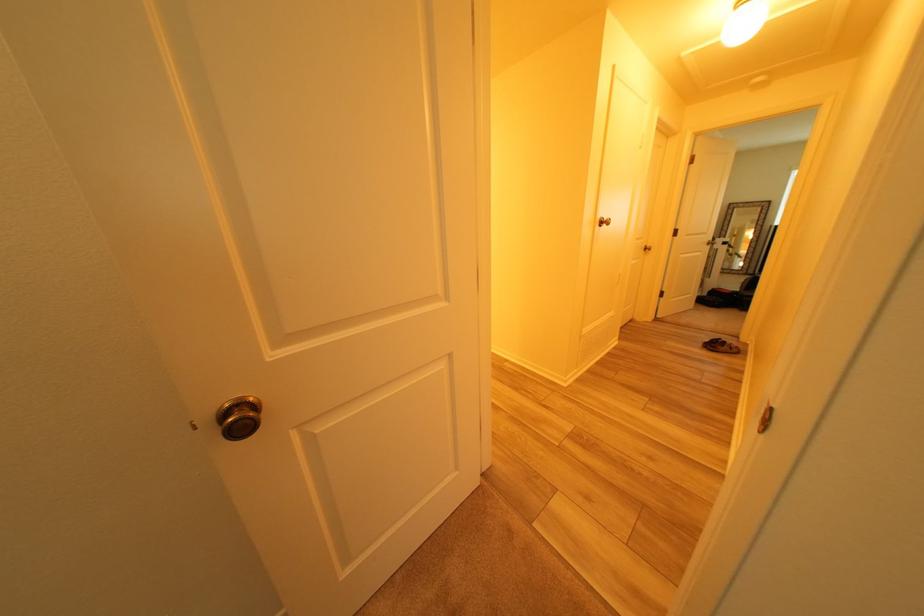
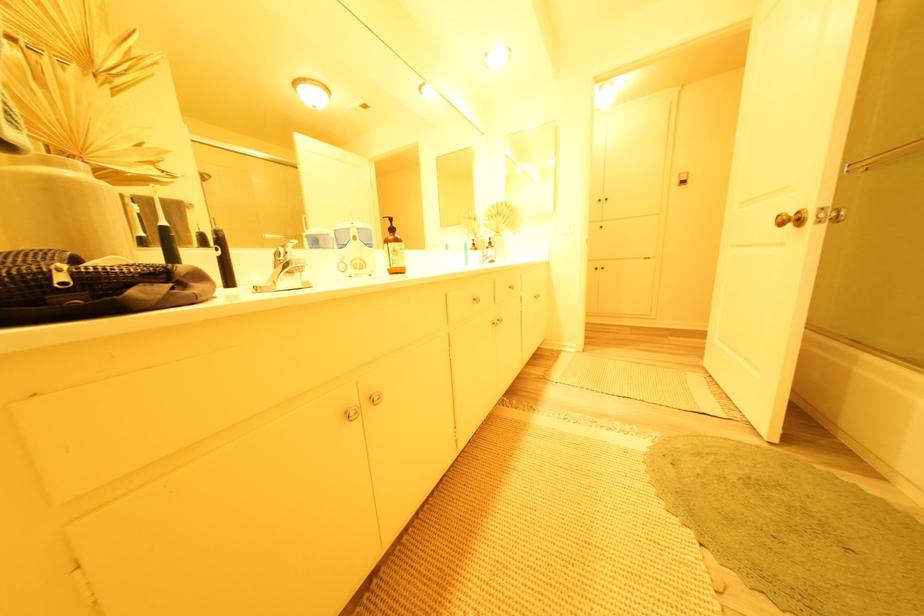
The images are taken continuously from a first-person perspective. In which direction are you moving?

The cameraman walked toward left, forward.